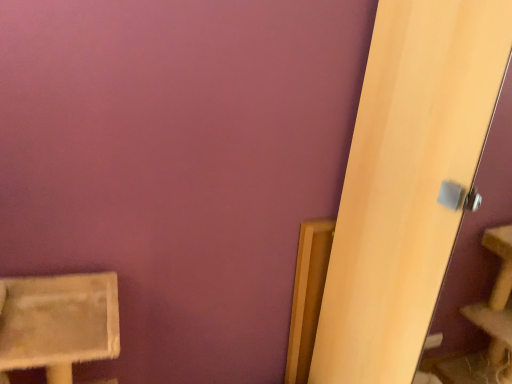
Locate an element on the screen. This screenshot has width=512, height=384. light wood screen door at right is located at coordinates (407, 182).

The width and height of the screenshot is (512, 384). What do you see at coordinates (407, 182) in the screenshot?
I see `light wood screen door at right` at bounding box center [407, 182].

The width and height of the screenshot is (512, 384). What do you see at coordinates (58, 322) in the screenshot? I see `beige textured cat tree at lower left` at bounding box center [58, 322].

The width and height of the screenshot is (512, 384). Identify the location of beige textured cat tree at lower left. (58, 322).

Measure the distance between point [10,298] and camera.

Point [10,298] and camera are 3.83 feet apart.

In order to click on light wood screen door at right in this screenshot , I will do `click(407, 182)`.

Which is more to the left, light wood screen door at right or beige textured cat tree at lower left?

beige textured cat tree at lower left.

Relative to beige textured cat tree at lower left, is light wood screen door at right in front or behind?

light wood screen door at right is in front of beige textured cat tree at lower left.

Which is in front, point (390, 12) or point (20, 331)?

Point (20, 331)

From the image's perspective, relative to beige textured cat tree at lower left, is light wood screen door at right above or below?

From the image's perspective, light wood screen door at right appears above beige textured cat tree at lower left.

From a real-world perspective, between light wood screen door at right and beige textured cat tree at lower left, who is vertically higher?

In real-world perspective, light wood screen door at right is above.

Considering the relative sizes of light wood screen door at right and beige textured cat tree at lower left in the image provided, is light wood screen door at right wider than beige textured cat tree at lower left?

Correct, the width of light wood screen door at right exceeds that of beige textured cat tree at lower left.

Who is taller, light wood screen door at right or beige textured cat tree at lower left?

light wood screen door at right.

Who is smaller, light wood screen door at right or beige textured cat tree at lower left?

With smaller size is beige textured cat tree at lower left.

Would you say light wood screen door at right contains beige textured cat tree at lower left?

Actually, beige textured cat tree at lower left is outside light wood screen door at right.

Is light wood screen door at right in contact with beige textured cat tree at lower left?

There is a gap between light wood screen door at right and beige textured cat tree at lower left.

Is beige textured cat tree at lower left at the back of light wood screen door at right?

No, light wood screen door at right is not facing the opposite direction of beige textured cat tree at lower left.

How different are the orientations of light wood screen door at right and beige textured cat tree at lower left in degrees?

light wood screen door at right and beige textured cat tree at lower left are facing 90.5 degrees away from each other.

Image resolution: width=512 pixels, height=384 pixels. I want to click on furniture below the light wood screen door at right (from a real-world perspective), so 58,322.

Would you say beige textured cat tree at lower left is to the left or to the right of light wood screen door at right in the picture?

Clearly, beige textured cat tree at lower left is on the left of light wood screen door at right in the image.

Which object is more forward, beige textured cat tree at lower left or light wood screen door at right?

Positioned in front is light wood screen door at right.

Is point (39, 281) positioned in front of point (429, 107)?

No, (39, 281) is behind (429, 107).

From the image's perspective, which is above, beige textured cat tree at lower left or light wood screen door at right?

light wood screen door at right is shown above in the image.

From a real-world perspective, which object stands above the other?

In real-world perspective, light wood screen door at right is above.

Considering the sizes of beige textured cat tree at lower left and light wood screen door at right in the image, is beige textured cat tree at lower left wider or thinner than light wood screen door at right?

Considering their sizes, beige textured cat tree at lower left looks slimmer than light wood screen door at right.

Which of these two, beige textured cat tree at lower left or light wood screen door at right, stands shorter?

beige textured cat tree at lower left.

Which of these two, beige textured cat tree at lower left or light wood screen door at right, is bigger?

light wood screen door at right is bigger.

Is beige textured cat tree at lower left located outside light wood screen door at right?

beige textured cat tree at lower left lies outside light wood screen door at right's area.

Does beige textured cat tree at lower left touch light wood screen door at right?

beige textured cat tree at lower left and light wood screen door at right are not in contact.

Is beige textured cat tree at lower left facing away from light wood screen door at right?

No, beige textured cat tree at lower left is not facing away from light wood screen door at right.

This screenshot has height=384, width=512. Find the location of `furniture below the light wood screen door at right (from a real-world perspective)`. furniture below the light wood screen door at right (from a real-world perspective) is located at coordinates click(58, 322).

Locate an element on the screen. The width and height of the screenshot is (512, 384). furniture located below the light wood screen door at right (from the image's perspective) is located at coordinates (58, 322).

At what (x,y) coordinates should I click in order to perform the action: click on furniture below the light wood screen door at right (from a real-world perspective). Please return your answer as a coordinate pair (x, y). The height and width of the screenshot is (384, 512). Looking at the image, I should click on (58, 322).